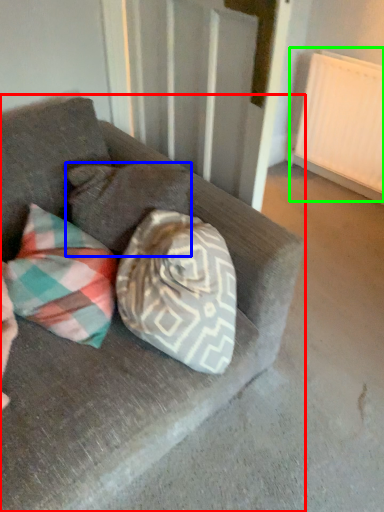
Question: Considering the real-world distances, which object is farthest from studio couch (highlighted by a red box)? pillow (highlighted by a blue box) or radiator (highlighted by a green box)?

Choices:
 (A) pillow
 (B) radiator

Answer: (B)